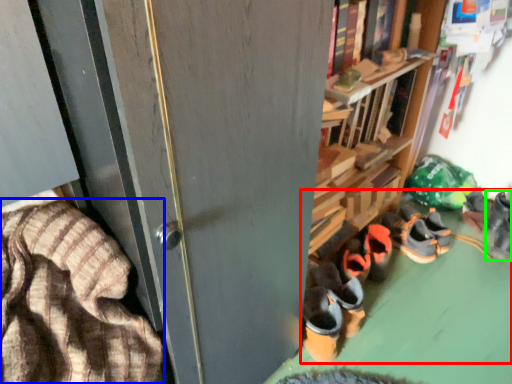
Question: Considering the real-world distances, which object is closest to footwear (highlighted by a red box)? blanket (highlighted by a blue box) or footwear (highlighted by a green box).

Choices:
 (A) blanket
 (B) footwear

Answer: (B)